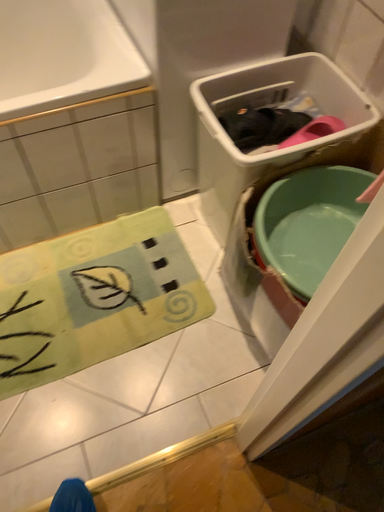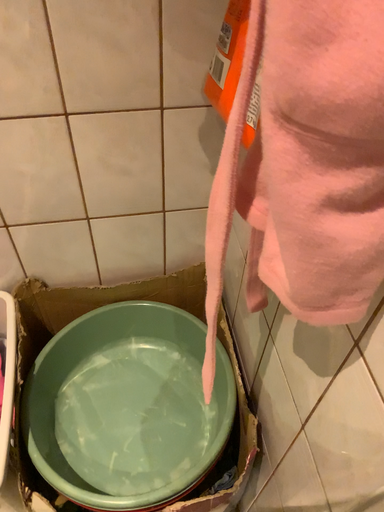
Question: Which way did the camera rotate in the video?

Choices:
 (A) rotated left
 (B) rotated right

Answer: (B)